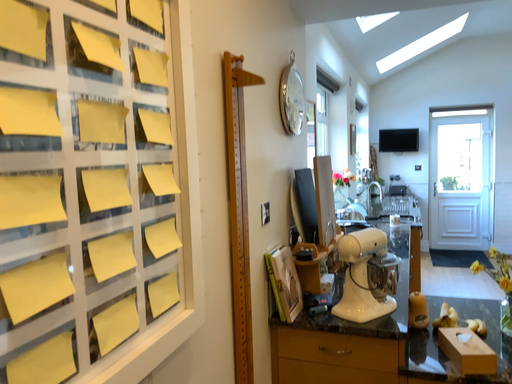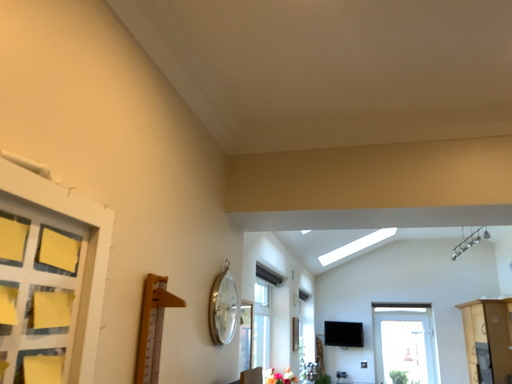
Question: How did the camera likely rotate when shooting the video?

Choices:
 (A) rotated left
 (B) rotated right

Answer: (B)